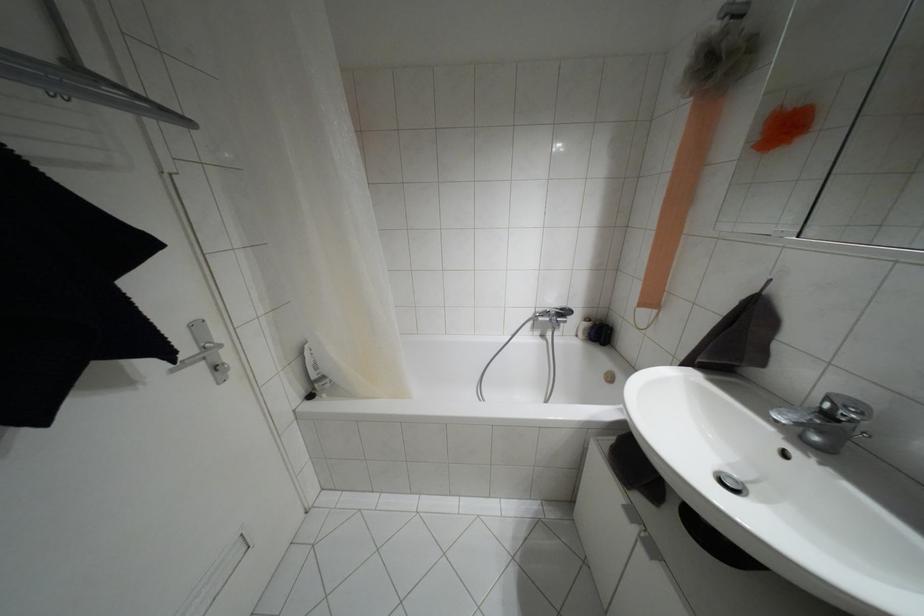
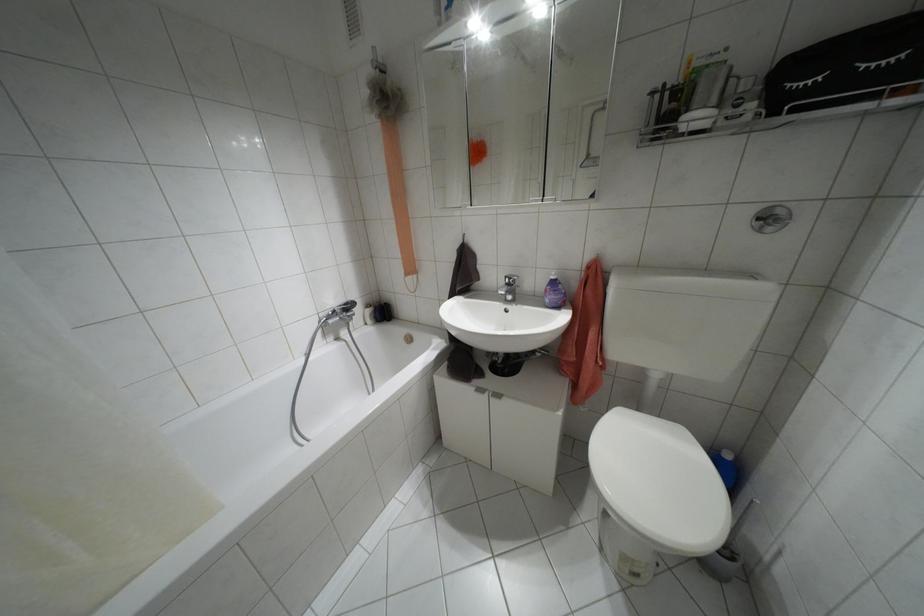
In the second image, find the point that corresponds to (x=586, y=318) in the first image.

(367, 305)